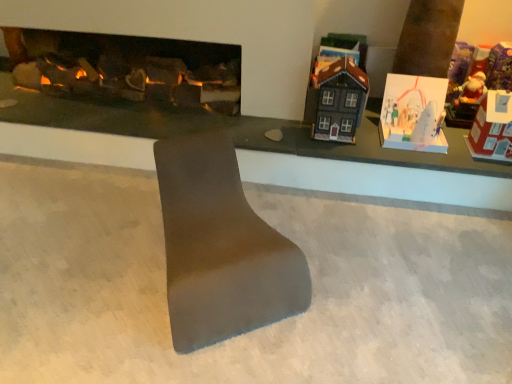
Find the location of a particular element. The width and height of the screenshot is (512, 384). free space above smooth gray concrete at center (from a real-world perspective) is located at coordinates (166, 276).